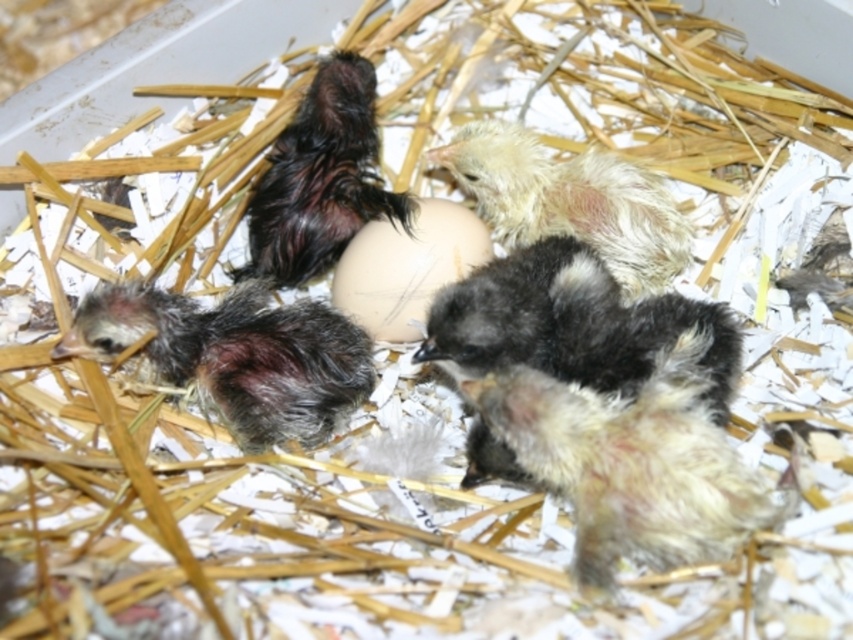
Question: Does dark gray fluffy chick at center come behind dark brown fluffy chick at center?

Choices:
 (A) yes
 (B) no

Answer: (B)

Question: Can you confirm if fluffy black chick at center is bigger than dark gray fluffy chick at center?

Choices:
 (A) no
 (B) yes

Answer: (B)

Question: Is dark brown fluffy chick at center above white smooth egg at center?

Choices:
 (A) yes
 (B) no

Answer: (A)

Question: Which object is positioned farthest from the white smooth egg at center?

Choices:
 (A) fluffy white bird at center
 (B) fluffy black chick at center
 (C) dark gray fluffy chick at center

Answer: (B)

Question: Among these points, which one is farthest from the camera?

Choices:
 (A) (735, 548)
 (B) (506, 301)
 (C) (427, 273)

Answer: (C)

Question: Which point is closer to the camera?

Choices:
 (A) (410, 212)
 (B) (485, 381)
 (C) (450, 234)
 (D) (502, 216)

Answer: (B)